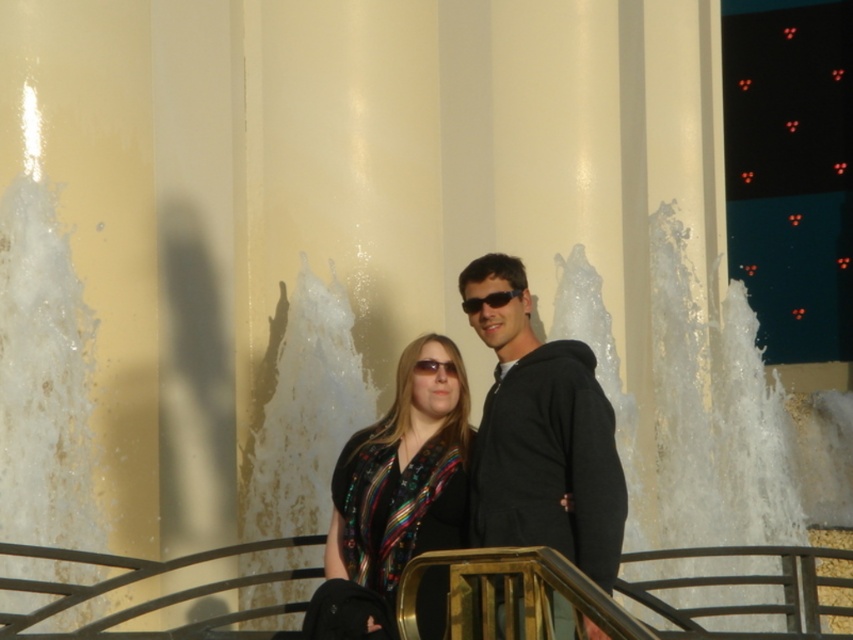
Is black matte hoodie at center to the left of black plastic sunglasses at center from the viewer's perspective?

No, black matte hoodie at center is not to the left of black plastic sunglasses at center.

Is point (613, 582) more distant than point (509, 294)?

That is False.

This screenshot has height=640, width=853. What do you see at coordinates (541, 436) in the screenshot?
I see `black matte hoodie at center` at bounding box center [541, 436].

You are a GUI agent. You are given a task and a screenshot of the screen. Output one action in this format:
    pyautogui.click(x=<x>, y=<y>)
    Task: Click on the black matte hoodie at center
    The height and width of the screenshot is (640, 853).
    Given the screenshot: What is the action you would take?
    pyautogui.click(x=541, y=436)

Does multicolored fabric blouse at center have a greater width compared to black plastic sunglasses at center?

Yes, multicolored fabric blouse at center is wider than black plastic sunglasses at center.

Can you confirm if multicolored fabric blouse at center is smaller than black plastic sunglasses at center?

Incorrect, multicolored fabric blouse at center is not smaller in size than black plastic sunglasses at center.

Between point (426, 512) and point (492, 307), which one is positioned in front?

Point (426, 512) is more forward.

Locate an element on the screen. The height and width of the screenshot is (640, 853). multicolored fabric blouse at center is located at coordinates (404, 474).

Is black matte hoodie at center thinner than multicolored fabric blouse at center?

Incorrect, black matte hoodie at center's width is not less than multicolored fabric blouse at center's.

What do you see at coordinates (541, 436) in the screenshot? This screenshot has width=853, height=640. I see `black matte hoodie at center` at bounding box center [541, 436].

Is point (544, 371) less distant than point (428, 387)?

Yes, point (544, 371) is in front of point (428, 387).

The image size is (853, 640). In order to click on black matte hoodie at center in this screenshot , I will do [541, 436].